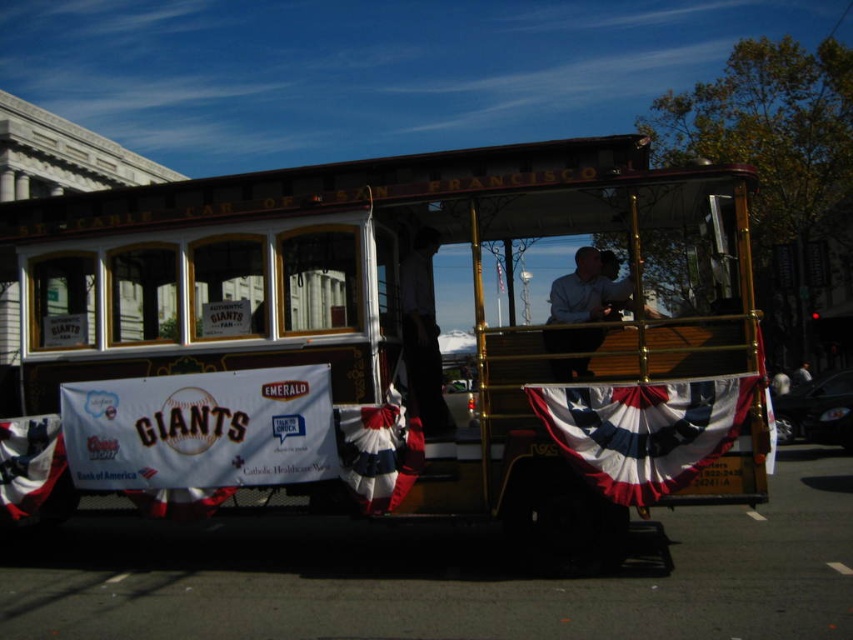
Question: Is light blue shirt at center further to the viewer compared to white fabric flag at center?

Choices:
 (A) no
 (B) yes

Answer: (A)

Question: Is wooden cable car at center positioned in front of light blue shirt at center?

Choices:
 (A) no
 (B) yes

Answer: (B)

Question: Among these points, which one is farthest from the camera?

Choices:
 (A) (90, 323)
 (B) (503, 282)
 (C) (558, 305)

Answer: (B)

Question: Based on their relative distances, which object is nearer to the light blue shirt at center?

Choices:
 (A) red fabric flag at lower left
 (B) wooden cable car at center

Answer: (B)

Question: Which point is farther to the camera?

Choices:
 (A) light blue shirt at center
 (B) wooden cable car at center
 (C) red-white-blue fabric banner at center
 (D) white fabric flag at center

Answer: (D)

Question: Does red-white-blue fabric banner at center have a lesser width compared to red fabric flag at lower left?

Choices:
 (A) no
 (B) yes

Answer: (A)